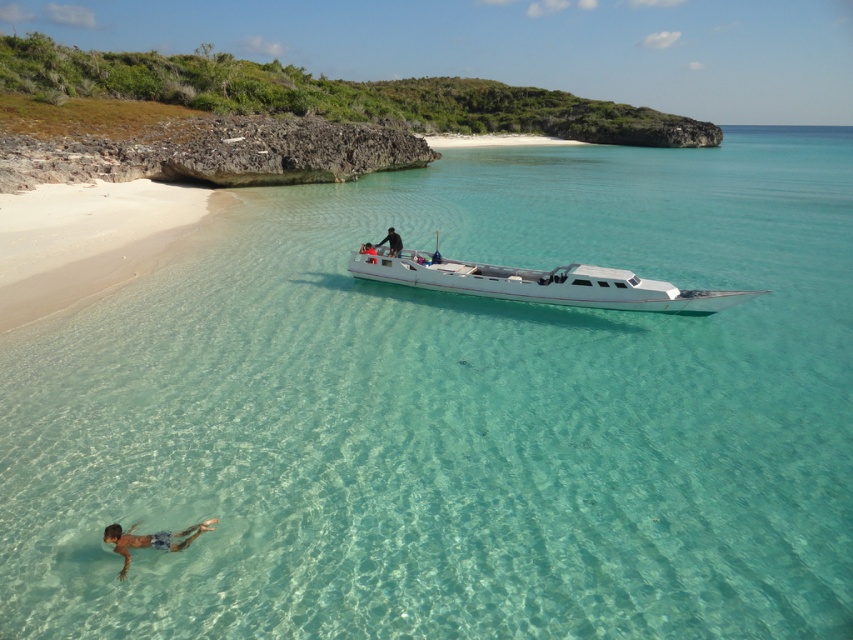
In the scene shown: Can you confirm if white sand beach at lower left is taller than white glossy boat at center?

Correct, white sand beach at lower left is much taller as white glossy boat at center.

What do you see at coordinates (86, 240) in the screenshot? This screenshot has width=853, height=640. I see `white sand beach at lower left` at bounding box center [86, 240].

I want to click on white sand beach at lower left, so click(x=86, y=240).

Who is more distant from viewer, (x=500, y=291) or (x=122, y=545)?

The point (x=500, y=291) is behind.

Can you confirm if white glossy boat at center is taller than tan skin person at lower left?

No.

Describe the element at coordinates (541, 284) in the screenshot. Image resolution: width=853 pixels, height=640 pixels. I see `white glossy boat at center` at that location.

Locate an element on the screen. This screenshot has height=640, width=853. white glossy boat at center is located at coordinates (541, 284).

Who is higher up, white sand beach at lower left or dark blue fabric shirt at center?

Positioned higher is white sand beach at lower left.

Does point (144, 252) come closer to viewer compared to point (393, 236)?

No, it is not.

The width and height of the screenshot is (853, 640). Find the location of `white sand beach at lower left`. white sand beach at lower left is located at coordinates (86, 240).